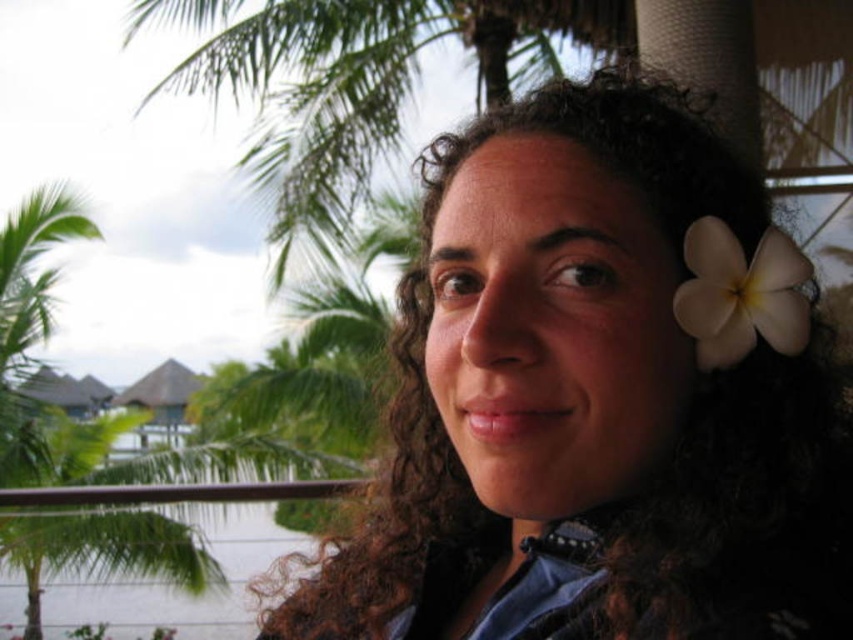
Question: Which point is closer to the camera?

Choices:
 (A) (508, 397)
 (B) (699, 241)
 (C) (55, 529)

Answer: (A)

Question: Is matte black hair at center smaller than green leafy palm tree at upper left?

Choices:
 (A) no
 (B) yes

Answer: (B)

Question: Among these objects, which one is farthest from the camera?

Choices:
 (A) white matte flower at upper right
 (B) matte black hair at center
 (C) green leafy palm tree at upper left

Answer: (C)

Question: Which object appears farthest from the camera in this image?

Choices:
 (A) white matte flower at upper right
 (B) green leafy palm tree at upper left

Answer: (B)

Question: Considering the relative positions of matte black hair at center and green leafy palm tree at upper left in the image provided, where is matte black hair at center located with respect to green leafy palm tree at upper left?

Choices:
 (A) right
 (B) left

Answer: (A)

Question: Can you confirm if matte black hair at center is positioned above white matte flower at upper right?

Choices:
 (A) no
 (B) yes

Answer: (A)